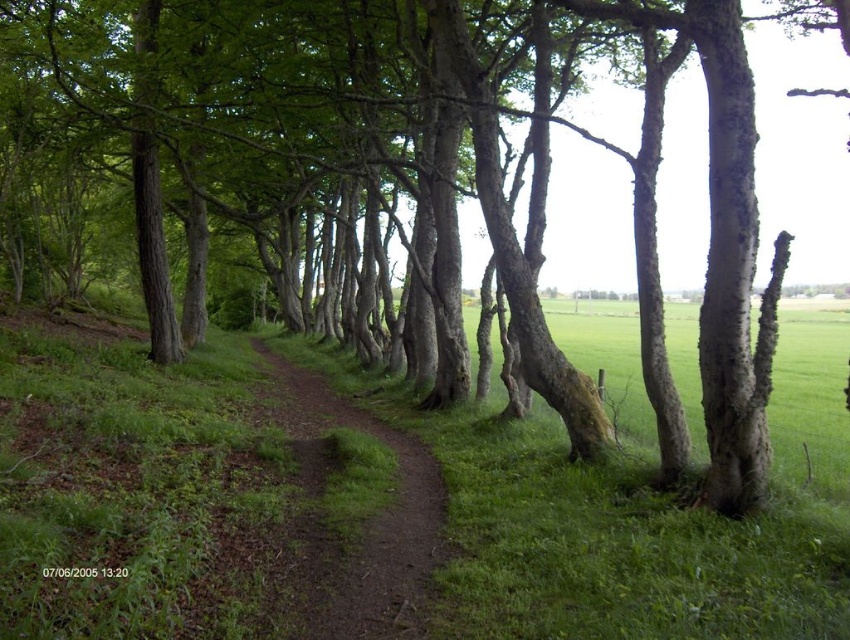
Can you confirm if green grassy at center is positioned below brown dirt path at center?

No.

Which is behind, point (820, 330) or point (354, 577)?

Point (820, 330)

Is point (507, 528) positioned in front of point (358, 566)?

No, (507, 528) is further to viewer.

Where is `green grassy at center`? This screenshot has height=640, width=850. green grassy at center is located at coordinates (156, 492).